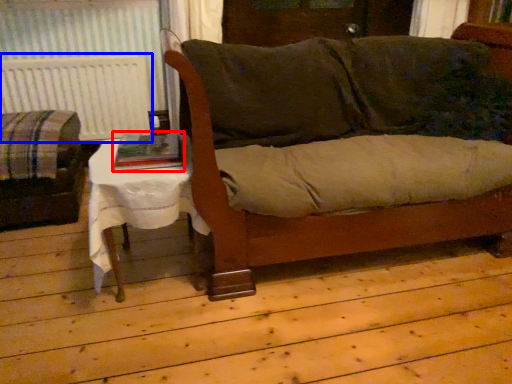
Question: Which object is further to the camera taking this photo, book (highlighted by a red box) or radiator (highlighted by a blue box)?

Choices:
 (A) book
 (B) radiator

Answer: (B)